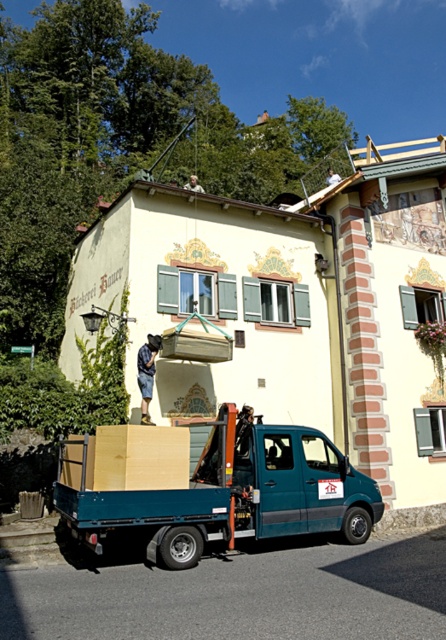
Question: Which of the following is the farthest from the observer?

Choices:
 (A) wooden crate at center
 (B) light brown cardboard at center

Answer: (B)

Question: In this image, where is wooden crate at center located relative to light brown cardboard at center?

Choices:
 (A) below
 (B) above

Answer: (A)

Question: Is wooden crate at center bigger than light brown cardboard at center?

Choices:
 (A) no
 (B) yes

Answer: (B)

Question: Is wooden crate at center smaller than light brown cardboard at center?

Choices:
 (A) yes
 (B) no

Answer: (B)

Question: Which object is closer to the camera taking this photo?

Choices:
 (A) wooden crate at center
 (B) light brown cardboard at center

Answer: (A)